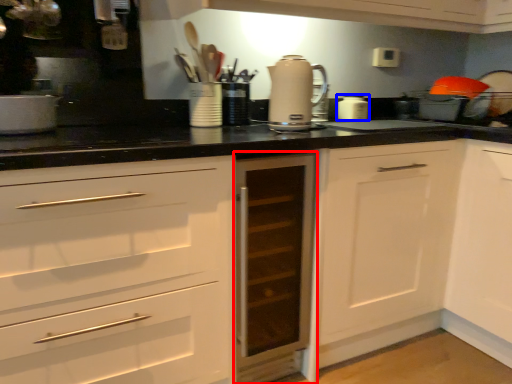
Question: Which object appears closest to the camera in this image, cabinetry (highlighted by a red box) or kitchen appliance (highlighted by a blue box)?

Choices:
 (A) cabinetry
 (B) kitchen appliance

Answer: (A)